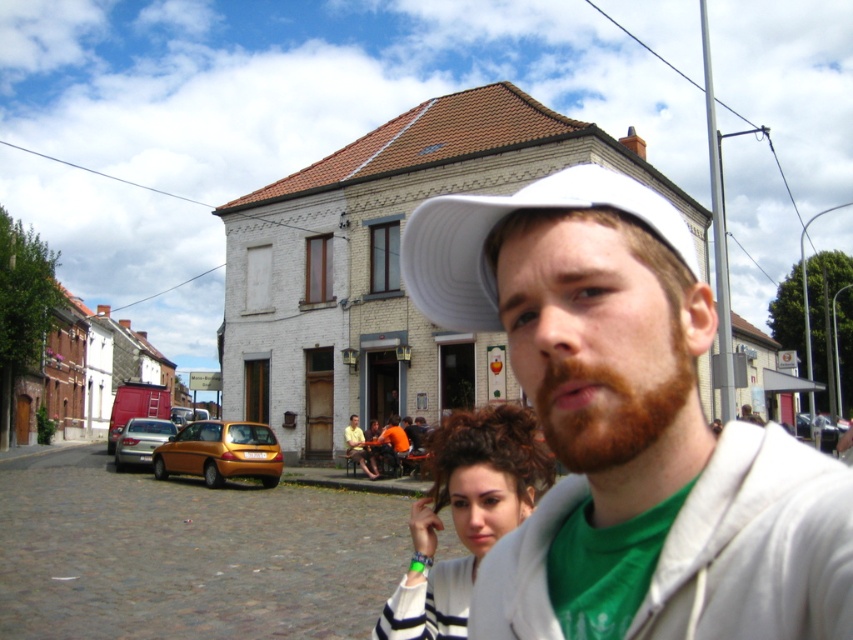
You are a photographer trying to capture a clear shot of both the curly brown hair at center and the orange shirt at center. Which object should you focus on first to ensure both are in focus?

The curly brown hair at center is closer to the viewer than the orange shirt at center. To ensure both are in focus, you should focus on the curly brown hair at center first, as it is the closer object.

You are a photographer trying to capture a clear shot of both the curly brown hair at center and the orange shirt at center. Based on their sizes in the image, which one should you focus on first to ensure both are in focus?

Since the curly brown hair at center occupies less space than orange shirt at center, you should focus on the orange shirt at center first. This way, the larger object will be in focus, and the smaller curly brown hair at center will likely also be in focus due to depth of field.

You are a photographer standing in the street scene. You want to take a photo of the gold metallic hatchback at lower left and the orange shirt at center. Which object is positioned closer to you?

The gold metallic hatchback at lower left is closer to the viewer than the orange shirt at center.